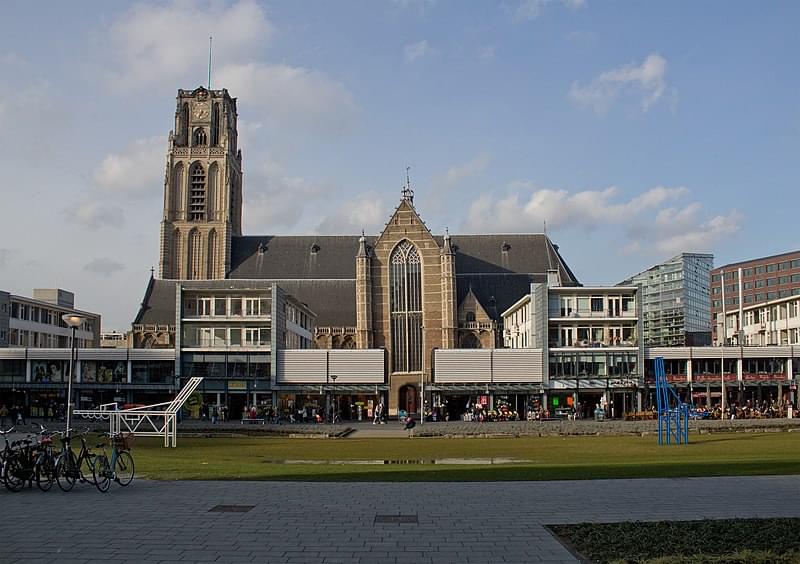
This screenshot has width=800, height=564. I want to click on white frame, so (152, 411).